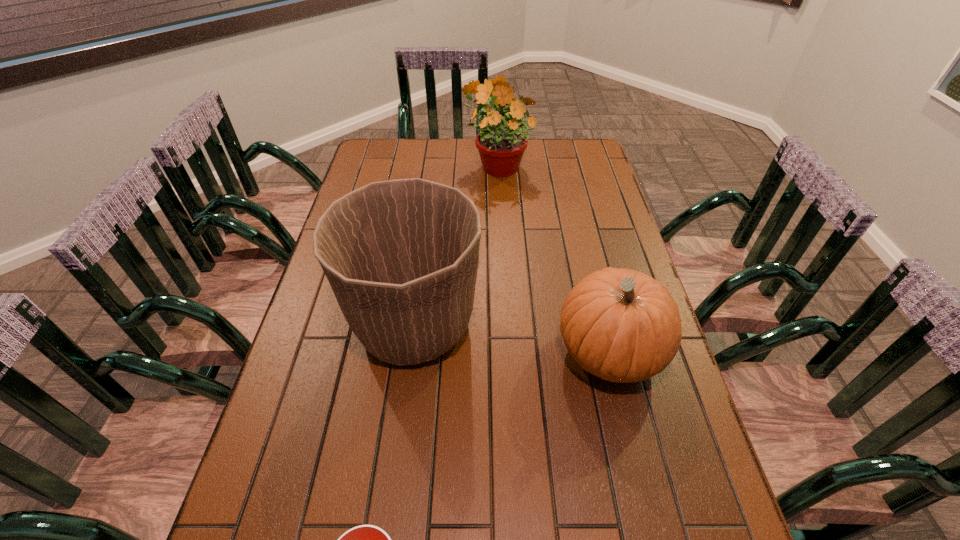
Locate which object ranks second in proximity to the second shortest object. Please provide its 2D coordinates. Your answer should be formatted as a tuple, i.e. [(x, y)], where the tuple contains the x and y coordinates of a point satisfying the conditions above.

[(365, 539)]